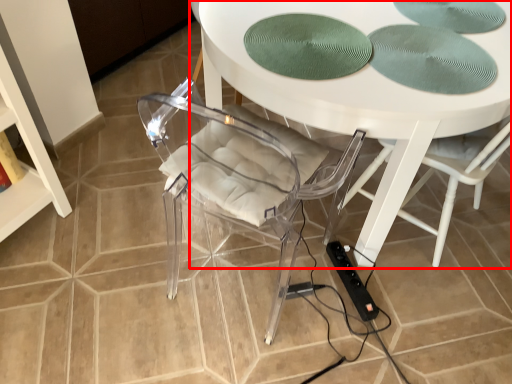
Question: Where is table (annotated by the red box) located in relation to extension cord in the image?

Choices:
 (A) right
 (B) left

Answer: (A)